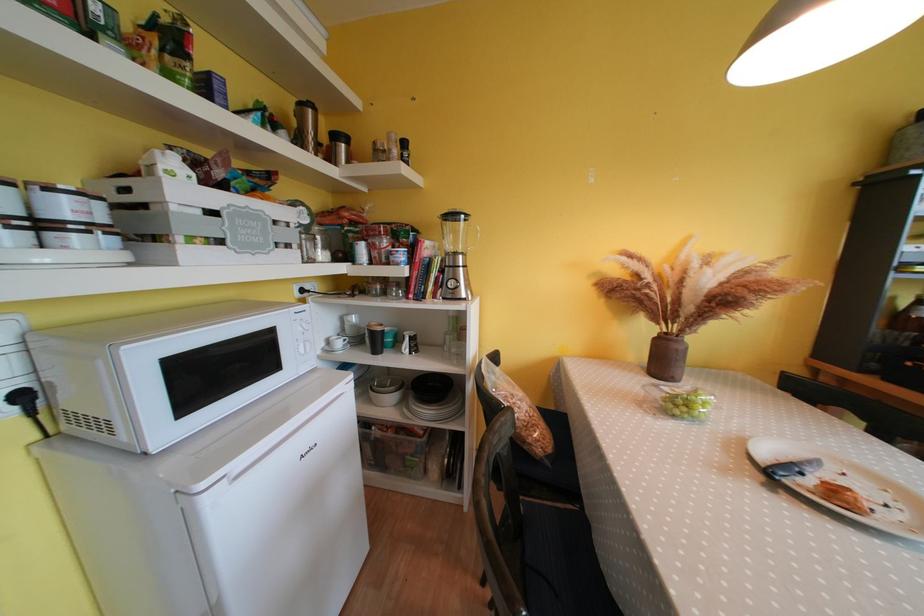
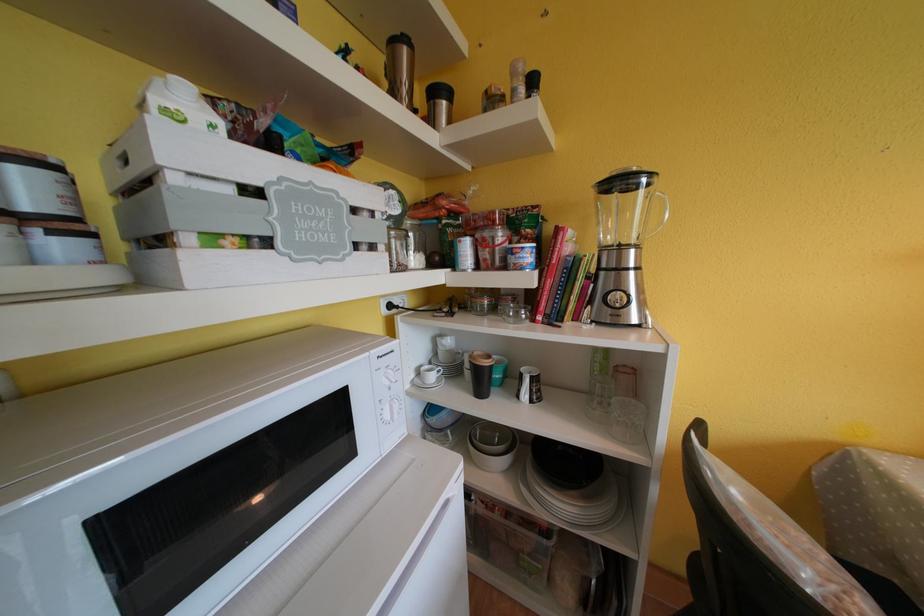
Locate, in the second image, the point that corresponds to (x=412, y=354) in the first image.

(533, 400)